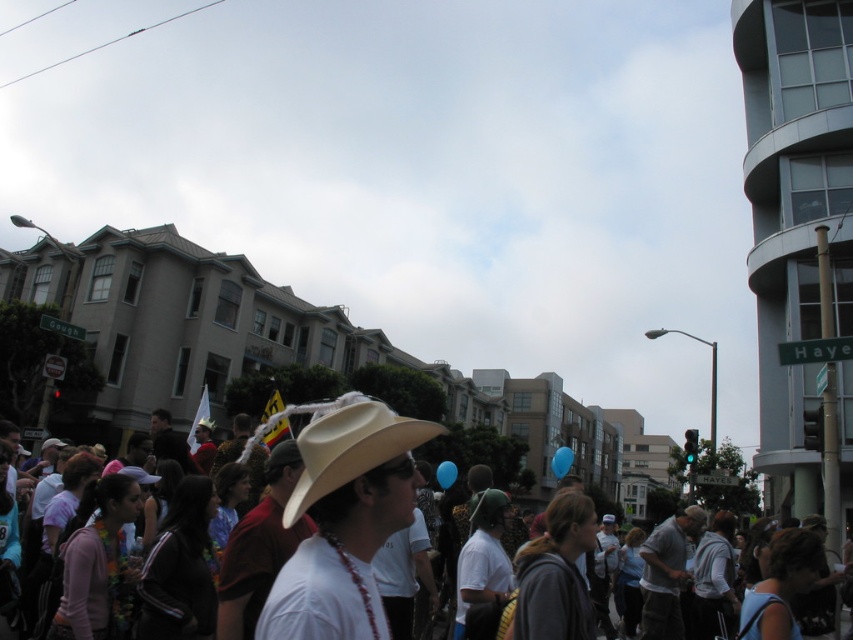
You are a photographer positioned at the center of the scene. You want to capture a photo that includes both the white matte cowboy hat at center and the beige felt cowboy hat at center. Given that your camera has a maximum focal length that allows capturing objects up to 50 meters apart, will you be able to include both hats in the same frame?

The white matte cowboy hat at center and beige felt cowboy hat at center are 54.86 meters apart from each other. Since the distance exceeds the camera maximum focal length of 50 meters, you will not be able to include both hats in the same frame.

You are a photographer trying to capture the man with the white matte cowboy hat at center. Based on the scene description, where should you position your camera to ensure the hat is in the frame?

The white matte cowboy hat at center is located at point (78,484), so you should position your camera to focus on that coordinate to include the hat in the frame.

You are a photographer trying to capture both the white matte cowboy hat at center and the beige felt cowboy hat at center in the same frame. Which hat will appear taller in the photo?

The white matte cowboy hat at center will appear taller in the photo since it is taller than the beige felt cowboy hat at center according to the description.